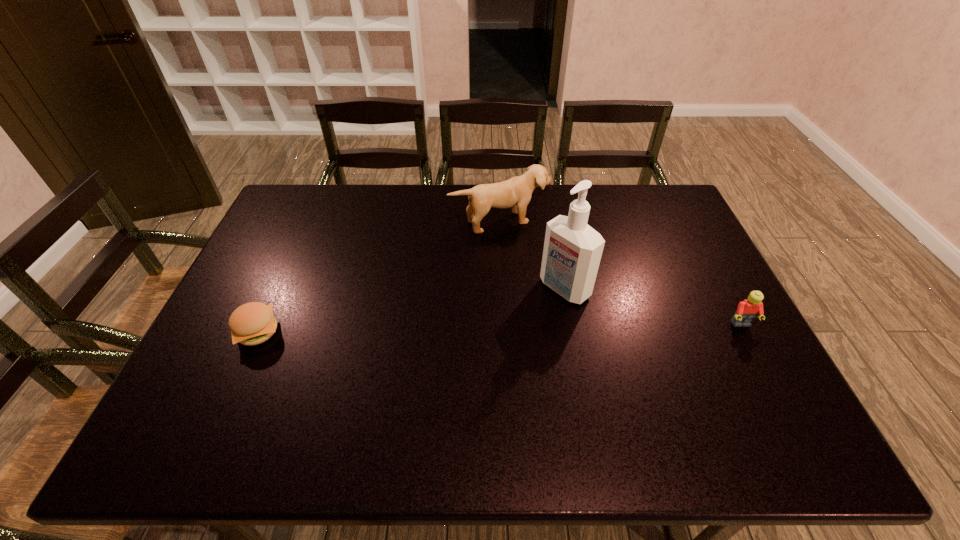
Where is `free location located 0.130m on the left side of the farthest object`? The height and width of the screenshot is (540, 960). free location located 0.130m on the left side of the farthest object is located at coordinates (534, 260).

Identify the location of free point located on the left side of the farthest object. (538, 266).

This screenshot has width=960, height=540. I want to click on vacant space situated on the left side of the farthest object, so click(548, 282).

Where is `vacant area located on the front label of the tallest object`? This screenshot has height=540, width=960. vacant area located on the front label of the tallest object is located at coordinates (506, 334).

Identify the location of free region located 0.210m on the front label of the tallest object. (494, 342).

Identify the location of free space located on the front label of the tallest object. click(x=506, y=334).

At what (x,y) coordinates should I click in order to perform the action: click on object at the far edge. Please return your answer as a coordinate pair (x, y). This screenshot has width=960, height=540. Looking at the image, I should click on (516, 192).

Where is `object located in the left edge section of the desktop`? The height and width of the screenshot is (540, 960). object located in the left edge section of the desktop is located at coordinates (253, 323).

This screenshot has height=540, width=960. In order to click on object located at the right edge in this screenshot , I will do `click(747, 310)`.

Image resolution: width=960 pixels, height=540 pixels. In the image, there is a desktop. What are the coordinates of `free space at the far edge` in the screenshot? It's located at (572, 187).